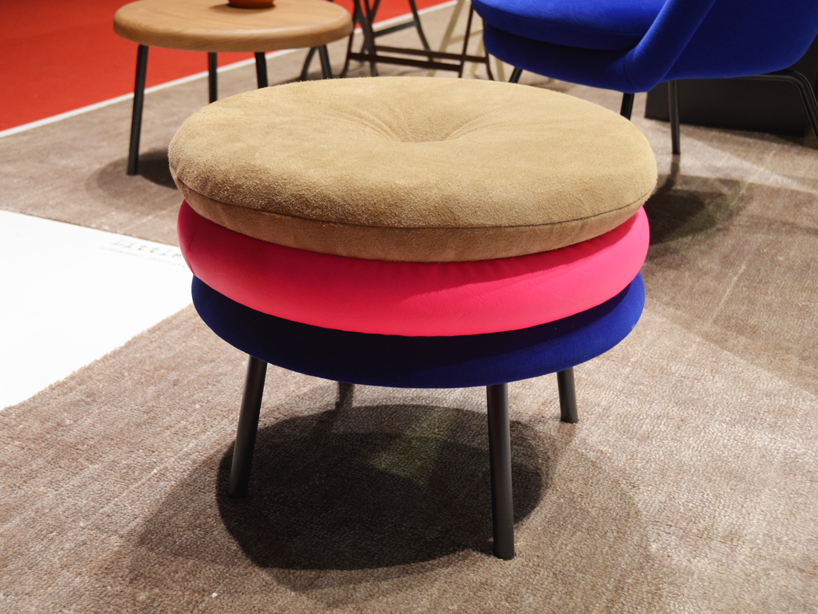
This screenshot has width=818, height=614. In order to click on stool leg in this screenshot , I will do `click(501, 453)`.